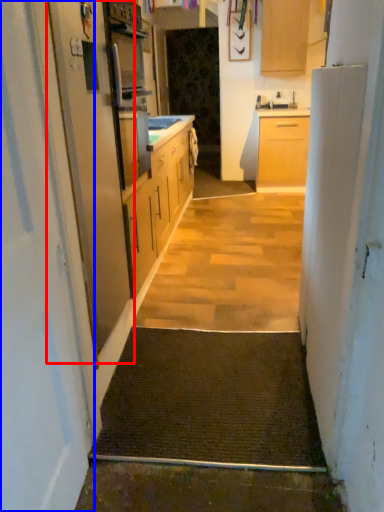
Question: Which point is further to the camera, screen door (highlighted by a red box) or door (highlighted by a blue box)?

Choices:
 (A) screen door
 (B) door

Answer: (A)